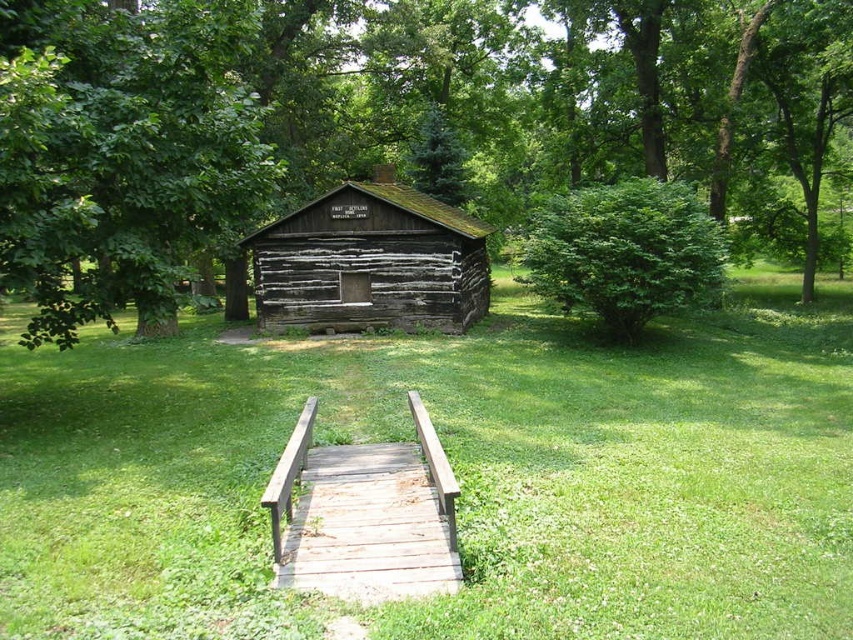
You are a visitor standing on the wooden bridge leading to the rustic log cabin. You notice a green leafy tree at center and a weathered wood rail at center. Which object is taller?

The green leafy tree at center is taller than the weathered wood rail at center.

You are a visitor at the park and want to take a photo of the green leafy tree at center and the weathered wood rail at center. Which object should you focus on first if you want to capture both in the frame without moving the camera?

The green leafy tree at center is bigger than the weathered wood rail at center, so you should focus on the green leafy tree at center first to ensure it fills the frame appropriately while still including the weathered wood rail at center in the background.